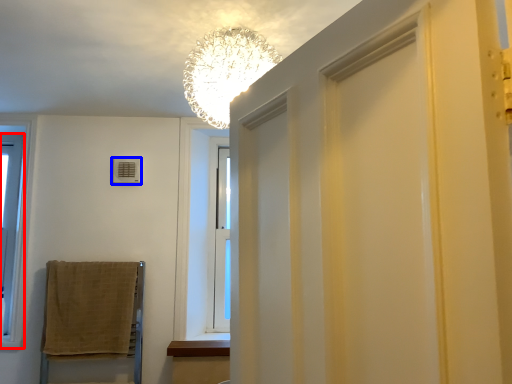
Question: Which object appears farthest to the camera in this image, window (highlighted by a red box) or air conditioner (highlighted by a blue box)?

Choices:
 (A) window
 (B) air conditioner

Answer: (B)